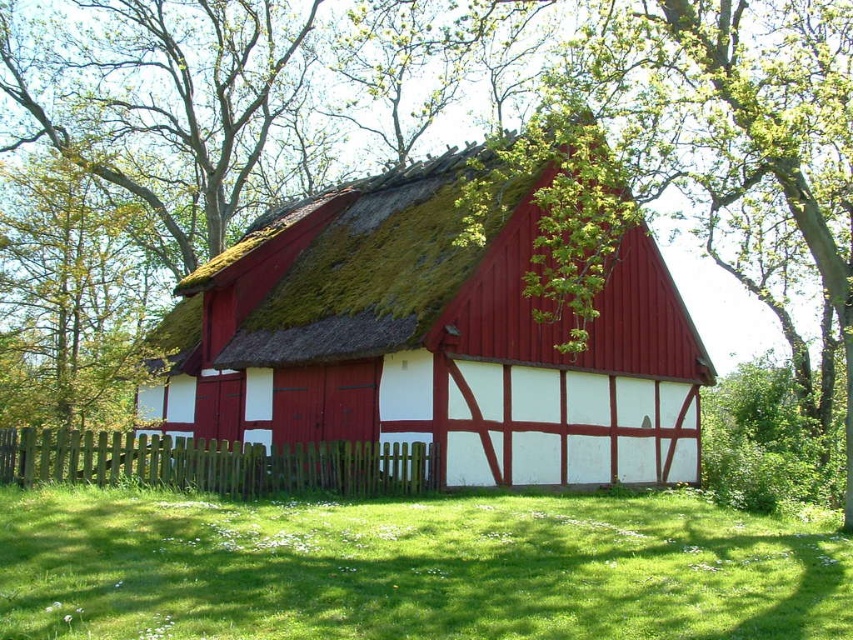
Who is shorter, matte red wood cottage at center or green grass at lower center?

green grass at lower center is shorter.

In the scene shown: Does matte red wood cottage at center appear on the right side of green grass at lower center?

No, matte red wood cottage at center is not to the right of green grass at lower center.

Where is `matte red wood cottage at center`? matte red wood cottage at center is located at coordinates (432, 340).

Identify the location of matte red wood cottage at center. (432, 340).

Who is taller, green grass at lower center or green wooden fence at lower center?

With more height is green wooden fence at lower center.

Measure the distance between green grass at lower center and camera.

27.12 feet

Where is `green grass at lower center`? green grass at lower center is located at coordinates (412, 568).

What do you see at coordinates (432, 340) in the screenshot?
I see `matte red wood cottage at center` at bounding box center [432, 340].

Can you confirm if matte red wood cottage at center is taller than green wooden fence at lower center?

Yes.

Which is behind, point (538, 372) or point (39, 472)?

The point (538, 372) is more distant.

You are a GUI agent. You are given a task and a screenshot of the screen. Output one action in this format:
    pyautogui.click(x=<x>, y=<y>)
    Task: Click on the matte red wood cottage at center
    The height and width of the screenshot is (640, 853).
    Given the screenshot: What is the action you would take?
    pyautogui.click(x=432, y=340)